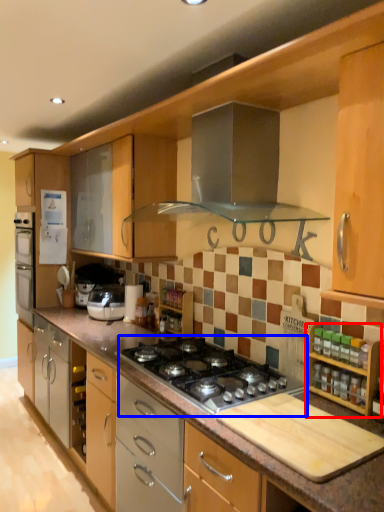
Question: Which object is further to the camera taking this photo, cabinetry (highlighted by a red box) or gas stove (highlighted by a blue box)?

Choices:
 (A) cabinetry
 (B) gas stove

Answer: (B)